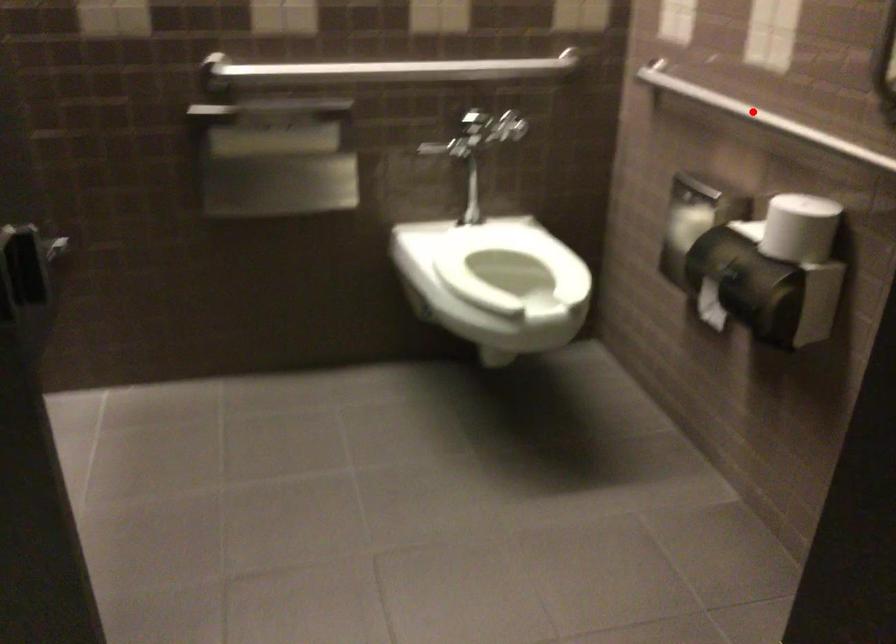
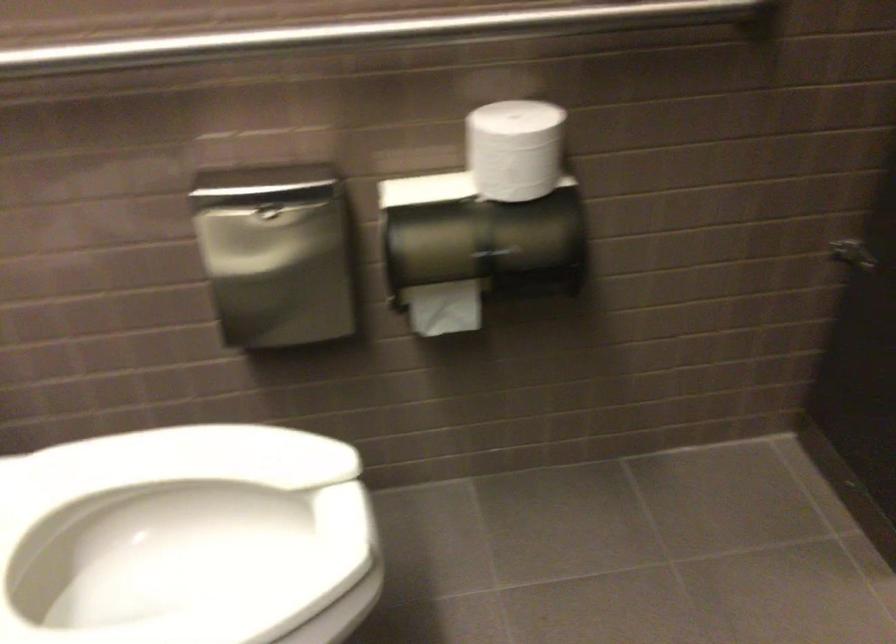
Question: I am providing you with two images of the same scene from different viewpoints. In image1, a red point is highlighted. Considering the same 3D point in image2, which of the following is correct?

Choices:
 (A) It is closer
 (B) It is farther

Answer: (A)